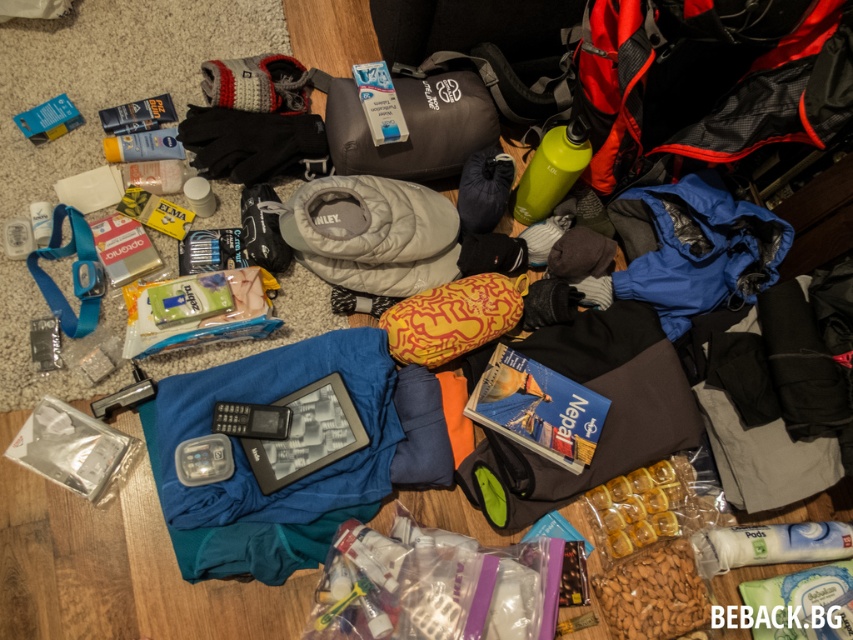
Question: Does blue fabric at center have a larger size compared to gray quilted sleeping bag at center?

Choices:
 (A) yes
 (B) no

Answer: (A)

Question: Which point is closer to the camera?

Choices:
 (A) gray quilted sleeping bag at center
 (B) blue fabric at center

Answer: (B)

Question: Is blue fabric at center to the left of gray quilted sleeping bag at center from the viewer's perspective?

Choices:
 (A) no
 (B) yes

Answer: (B)

Question: Among these objects, which one is nearest to the camera?

Choices:
 (A) blue fabric at center
 (B) gray quilted sleeping bag at center

Answer: (A)

Question: Is blue fabric at center smaller than gray quilted sleeping bag at center?

Choices:
 (A) no
 (B) yes

Answer: (A)